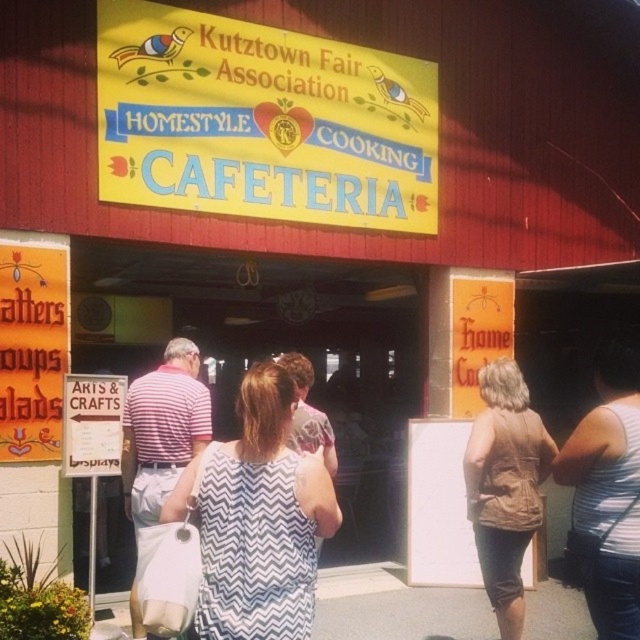
Question: Which point appears farthest from the camera in this image?

Choices:
 (A) (284, 38)
 (B) (492, 419)
 (C) (456, 513)

Answer: (C)

Question: Which of these objects is positioned farthest from the white matte bulletin board at center?

Choices:
 (A) white zigzag dress at center
 (B) yellow paper sign at upper center
 (C) white tank top at right

Answer: (A)

Question: Observing the image, what is the correct spatial positioning of white zigzag dress at center in reference to brown leather vest at lower right?

Choices:
 (A) above
 (B) below

Answer: (A)

Question: Can you confirm if yellow paper sign at upper center is positioned to the left of brown leather vest at lower right?

Choices:
 (A) no
 (B) yes

Answer: (B)

Question: Does yellow paper sign at upper center appear on the left side of brown leather vest at lower right?

Choices:
 (A) yes
 (B) no

Answer: (A)

Question: Based on their relative distances, which object is nearer to the white zigzag dress at center?

Choices:
 (A) brown leather vest at lower right
 (B) white matte bulletin board at center

Answer: (A)